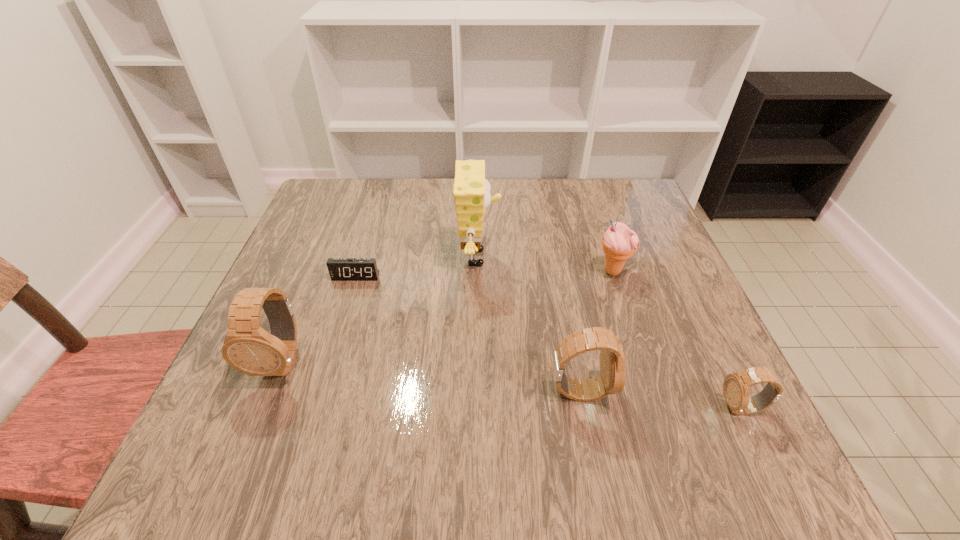
At what (x,y) coordinates should I click in order to perform the action: click on vacant position for inserting another watch evenly. Please return your answer as a coordinate pair (x, y). This screenshot has height=540, width=960. Looking at the image, I should click on (426, 376).